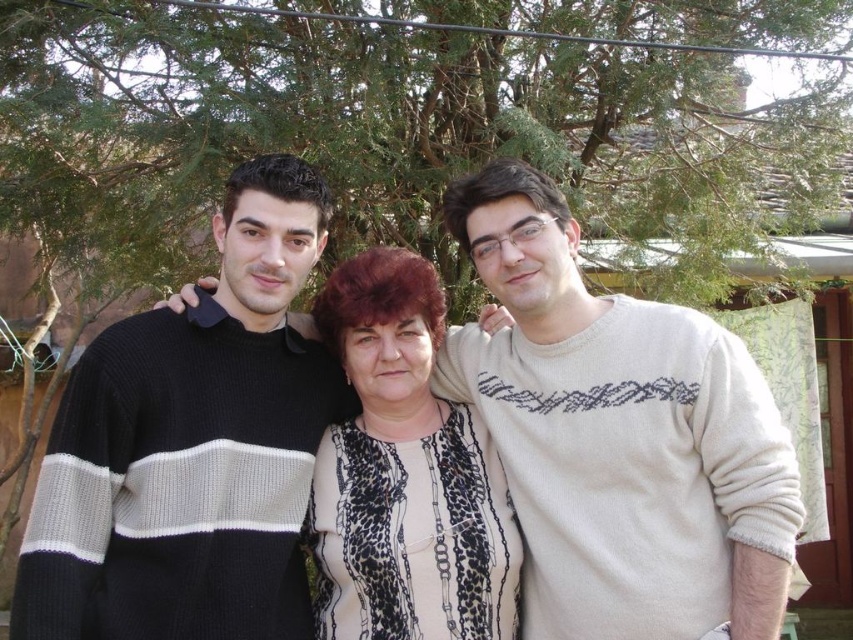
Question: In this image, where is black knit sweater at center located relative to black knitted sweater at left?

Choices:
 (A) left
 (B) right

Answer: (B)

Question: Which point is closer to the camera?

Choices:
 (A) black knit sweater at center
 (B) leopard print blouse at center
 (C) black knitted sweater at left

Answer: (C)

Question: Is black knit sweater at center in front of leopard print blouse at center?

Choices:
 (A) yes
 (B) no

Answer: (A)

Question: Which of the following is the closest to the observer?

Choices:
 (A) leopard print blouse at center
 (B) black knitted sweater at left
 (C) black knit sweater at center

Answer: (B)

Question: Which of the following is the farthest from the observer?

Choices:
 (A) (543, 336)
 (B) (424, 401)

Answer: (B)

Question: Does black knitted sweater at left appear on the left side of leopard print blouse at center?

Choices:
 (A) yes
 (B) no

Answer: (A)